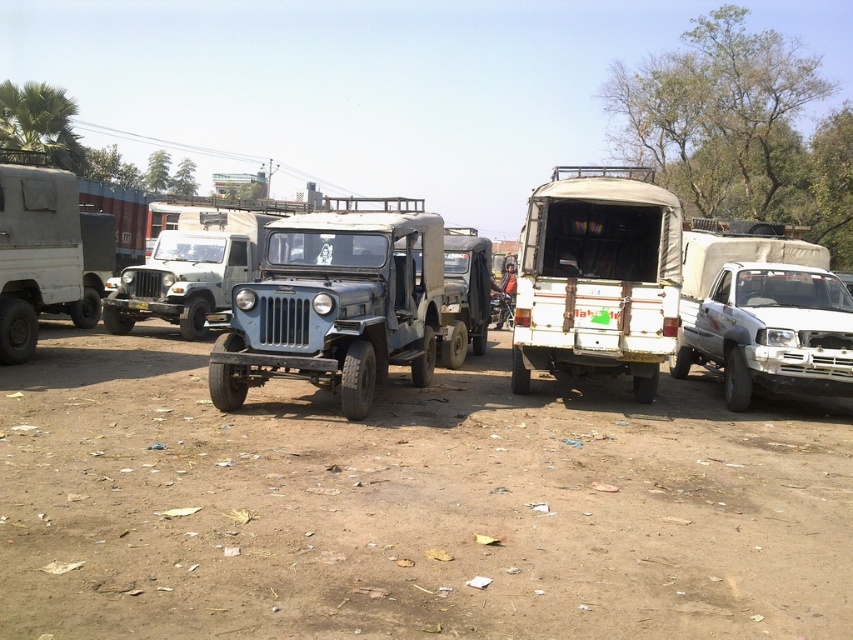
Question: Which point is farther from the camera taking this photo?

Choices:
 (A) (769, 451)
 (B) (593, 236)
 (C) (219, 301)

Answer: (C)

Question: Is dull brown dirt at center above blue matte jeep at center?

Choices:
 (A) no
 (B) yes

Answer: (A)

Question: Is white matte pickup truck at center above white matte truck at left?

Choices:
 (A) yes
 (B) no

Answer: (A)

Question: Which object is the farthest from the white matte truck at left?

Choices:
 (A) blue matte jeep at center
 (B) dull brown dirt at center
 (C) matte gray jeep at center

Answer: (B)

Question: Among these points, which one is nearest to the camera?

Choices:
 (A) 149,490
 (B) 4,234
 (C) 402,269
 (D) 154,285

Answer: (A)

Question: Is white matte pickup truck at center positioned in front of matte gray jeep at center?

Choices:
 (A) no
 (B) yes

Answer: (B)